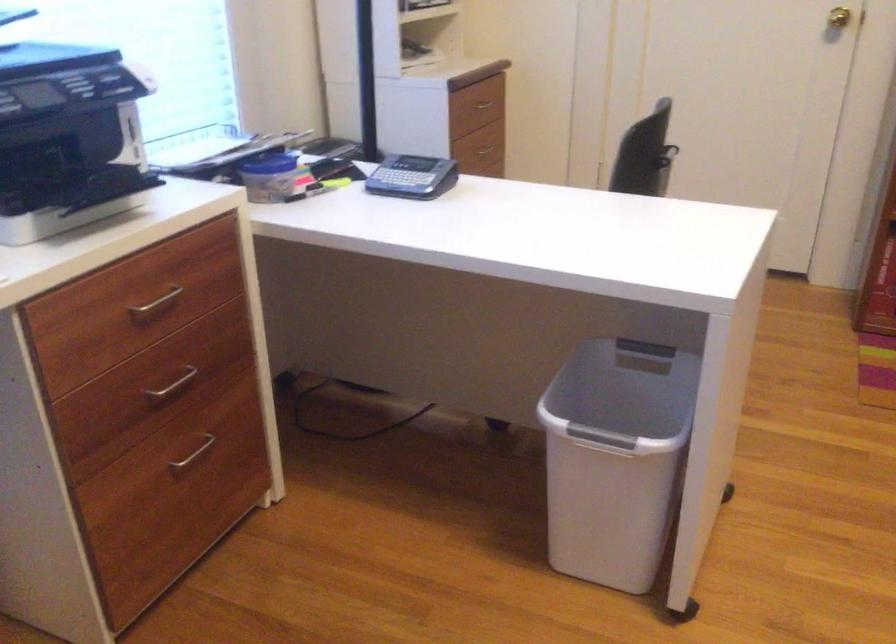
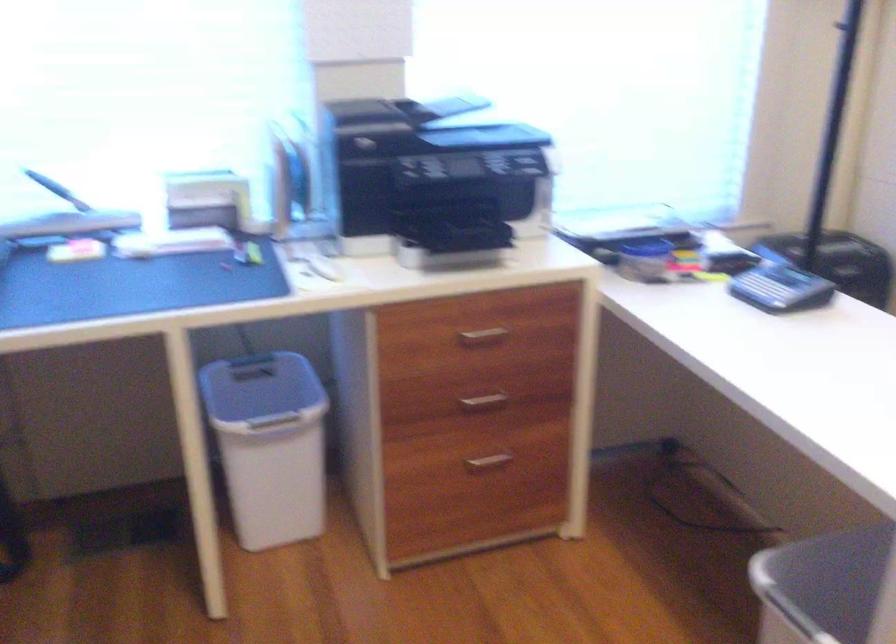
Locate, in the second image, the point that corresponds to point 186,457 in the first image.

(487, 462)